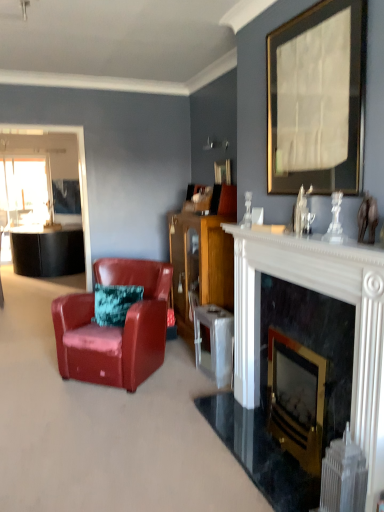
Question: Is wooden cabinet at center positioned in front of clear glass window screen at left?

Choices:
 (A) no
 (B) yes

Answer: (B)

Question: Is wooden cabinet at center facing away from clear glass window screen at left?

Choices:
 (A) yes
 (B) no

Answer: (B)

Question: From the image's perspective, does wooden cabinet at center appear higher than clear glass window screen at left?

Choices:
 (A) yes
 (B) no

Answer: (B)

Question: Can we say wooden cabinet at center lies outside clear glass window screen at left?

Choices:
 (A) no
 (B) yes

Answer: (B)

Question: Is wooden cabinet at center shorter than clear glass window screen at left?

Choices:
 (A) no
 (B) yes

Answer: (B)

Question: From the image's perspective, is black marble fireplace at center, which ranks as the 1th fireplace in left-to-right order, positioned above or below wooden picture frame at upper center, the first picture frame viewed from the left?

Choices:
 (A) below
 (B) above

Answer: (A)

Question: Is black marble fireplace at center, the second fireplace positioned from the right, bigger or smaller than wooden picture frame at upper center, the first picture frame viewed from the left?

Choices:
 (A) small
 (B) big

Answer: (B)

Question: From a real-world perspective, is black marble fireplace at center, which ranks as the 1th fireplace in left-to-right order, above or below wooden picture frame at upper center, the first picture frame viewed from the left?

Choices:
 (A) below
 (B) above

Answer: (A)

Question: Considering their positions, is black marble fireplace at center, which ranks as the 1th fireplace in left-to-right order, located in front of or behind wooden picture frame at upper center, the first picture frame viewed from the left?

Choices:
 (A) front
 (B) behind

Answer: (A)

Question: From the image's perspective, is leather armchair at left above or below white plastic radiator at lower right?

Choices:
 (A) below
 (B) above

Answer: (B)

Question: Does point (71, 302) appear closer or farther from the camera than point (324, 508)?

Choices:
 (A) farther
 (B) closer

Answer: (A)

Question: Considering the relative positions of leather armchair at left and white plastic radiator at lower right in the image provided, is leather armchair at left to the left or to the right of white plastic radiator at lower right?

Choices:
 (A) right
 (B) left

Answer: (B)

Question: Looking at their shapes, would you say leather armchair at left is wider or thinner than white plastic radiator at lower right?

Choices:
 (A) thin
 (B) wide

Answer: (B)

Question: Is point (248, 286) closer or farther from the camera than point (77, 331)?

Choices:
 (A) closer
 (B) farther

Answer: (A)

Question: Is black marble fireplace at center, the second fireplace positioned from the right, situated inside leather armchair at left or outside?

Choices:
 (A) inside
 (B) outside

Answer: (B)